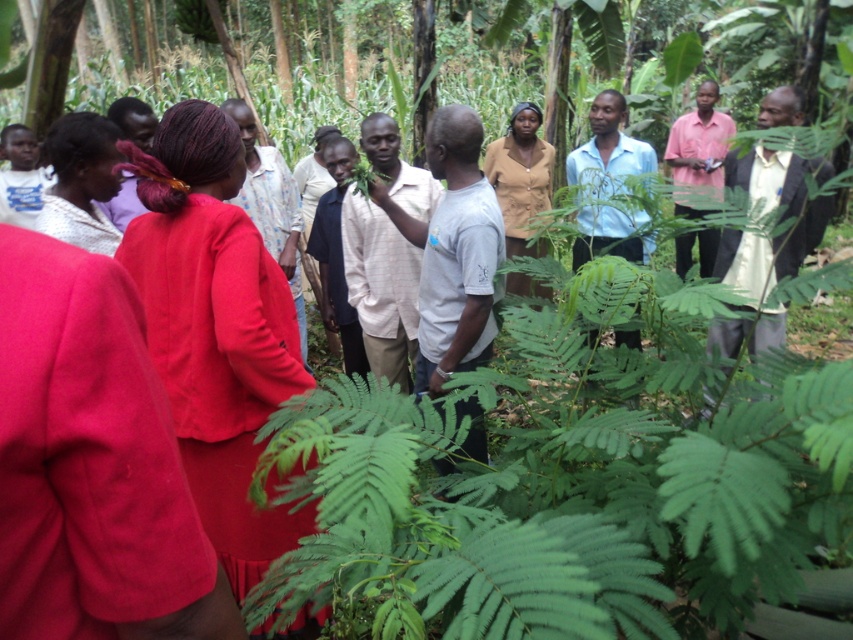
Between point (525, 228) and point (706, 172), which one is positioned behind?

Positioned behind is point (706, 172).

Which is behind, point (489, 160) or point (711, 275)?

The point (489, 160) is behind.

Image resolution: width=853 pixels, height=640 pixels. Find the location of `matte brown shirt at center`. matte brown shirt at center is located at coordinates (520, 177).

Can you confirm if matte red dress at center is positioned to the left of matte white shirt at center?

Incorrect, matte red dress at center is not on the left side of matte white shirt at center.

Measure the distance from matte red dress at center to matte white shirt at center.

They are 29.87 inches apart.

Which is in front, point (229, 545) or point (82, 182)?

Point (229, 545) is more forward.

Find the location of a particular element. matte red dress at center is located at coordinates (213, 326).

Who is more forward, (753,296) or (550,177)?

Point (753,296)

Locate an element on the screen. The height and width of the screenshot is (640, 853). light pink shirt at right is located at coordinates point(769,211).